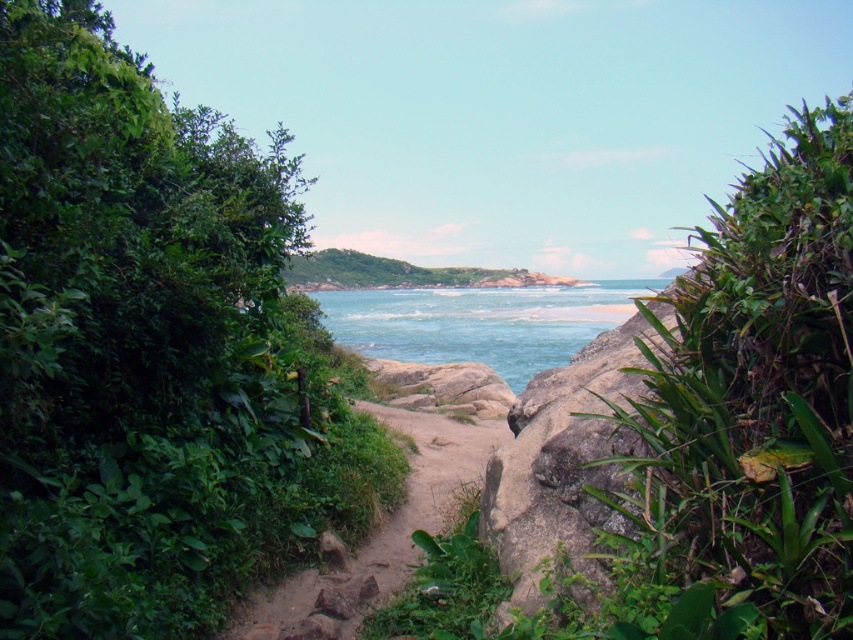
Is the position of green leafy bush at left less distant than that of blue clear water at center?

Yes, green leafy bush at left is closer to the viewer.

Does green leafy bush at left have a greater width compared to blue clear water at center?

No, green leafy bush at left is not wider than blue clear water at center.

Looking at this image, who is more forward, (4, 380) or (502, 289)?

Point (4, 380)

The width and height of the screenshot is (853, 640). Identify the location of green leafy bush at left. (154, 349).

Who is higher up, green leafy plant at right or dirt path at center?

green leafy plant at right

Which is in front, point (782, 468) or point (438, 433)?

Point (782, 468)

This screenshot has width=853, height=640. In order to click on green leafy plant at right in this screenshot , I will do pos(755,401).

Which is below, green leafy plant at right or blue clear water at center?

Positioned lower is green leafy plant at right.

Does green leafy plant at right have a smaller size compared to blue clear water at center?

Correct, green leafy plant at right occupies less space than blue clear water at center.

Does point (779, 508) come closer to viewer compared to point (343, 344)?

Yes, point (779, 508) is in front of point (343, 344).

This screenshot has width=853, height=640. What are the coordinates of `green leafy plant at right` in the screenshot? It's located at (755, 401).